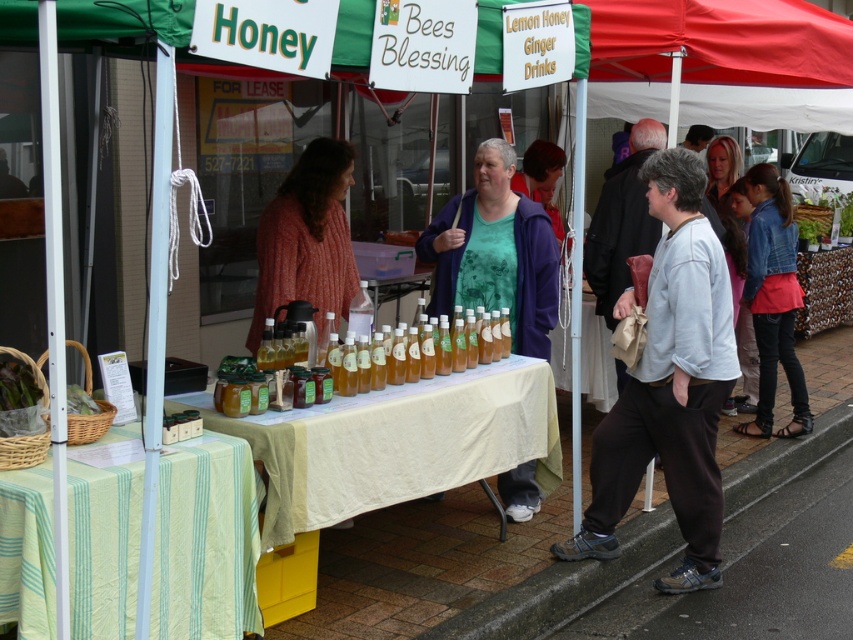
Question: Can you confirm if green striped fabric at lower left is positioned above blonde hair at upper right?

Choices:
 (A) yes
 (B) no

Answer: (B)

Question: Is light gray cotton shirt at center below white cloth-covered table at center?

Choices:
 (A) no
 (B) yes

Answer: (A)

Question: Does green striped fabric at lower left have a larger size compared to denim jacket at lower right?

Choices:
 (A) no
 (B) yes

Answer: (A)

Question: Which object is the farthest from the white cloth-covered table at center?

Choices:
 (A) blonde hair at upper right
 (B) green striped fabric at lower left
 (C) knitted wool sweater at center
 (D) light gray cotton shirt at center

Answer: (A)

Question: Which is nearer to the light gray cotton shirt at center?

Choices:
 (A) white cloth-covered table at center
 (B) blonde hair at upper right
 (C) knitted wool sweater at center

Answer: (A)

Question: Which object is closer to the camera taking this photo?

Choices:
 (A) blonde hair at upper right
 (B) light gray cotton shirt at center

Answer: (B)